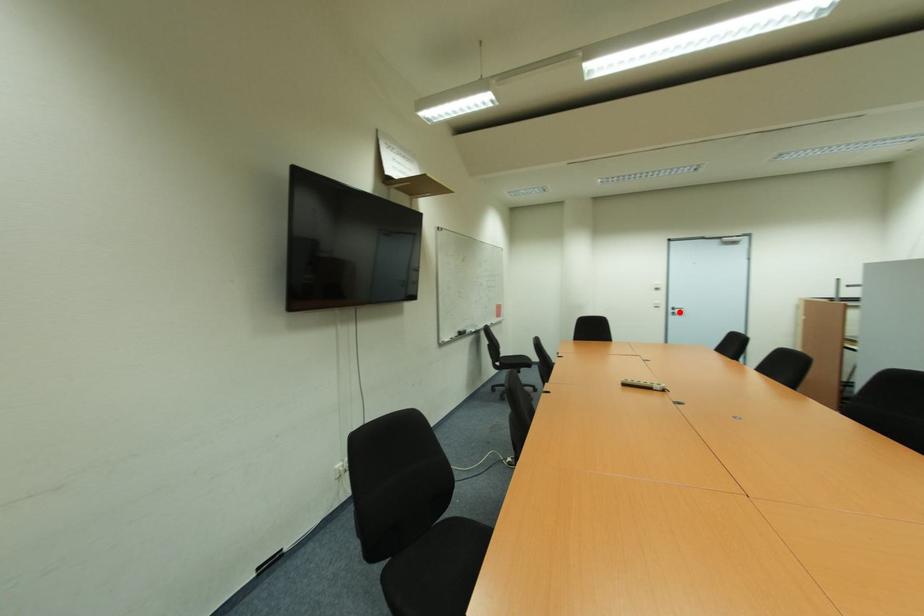
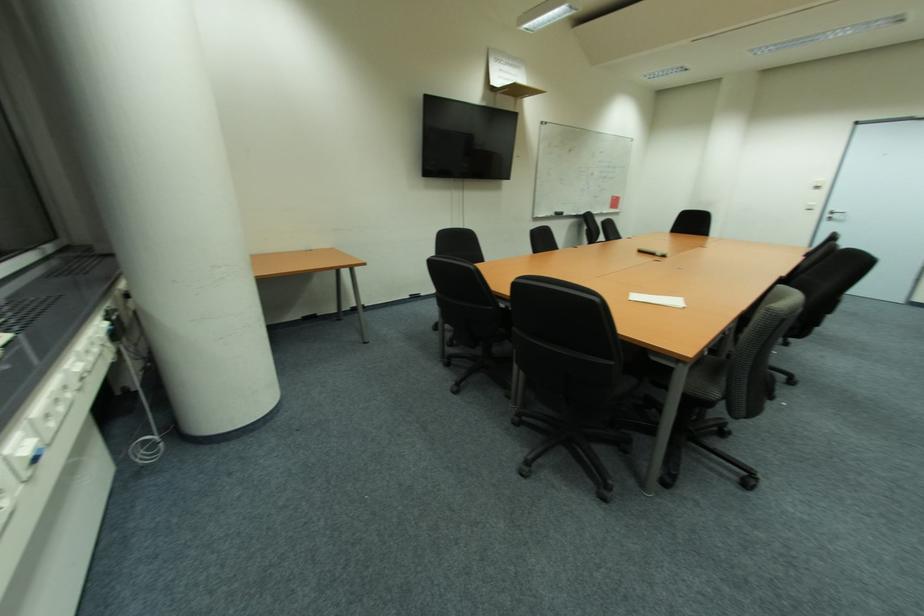
Locate, in the second image, the point that corresponds to the highlighted location in the first image.

(842, 217)